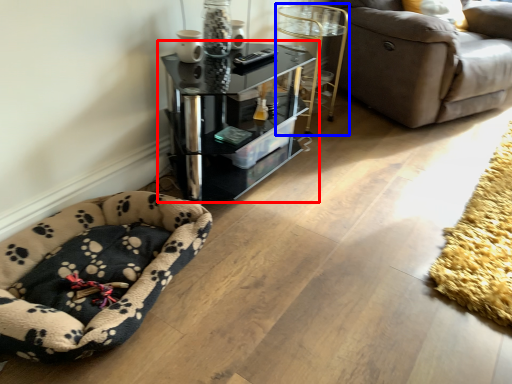
Question: Which point is further to the camera, table (highlighted by a red box) or side table (highlighted by a blue box)?

Choices:
 (A) table
 (B) side table

Answer: (B)